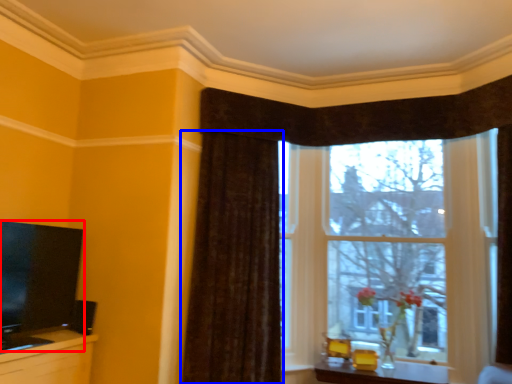
Question: Among these objects, which one is nearest to the camera, television (highlighted by a red box) or curtain (highlighted by a blue box)?

Choices:
 (A) television
 (B) curtain

Answer: (A)